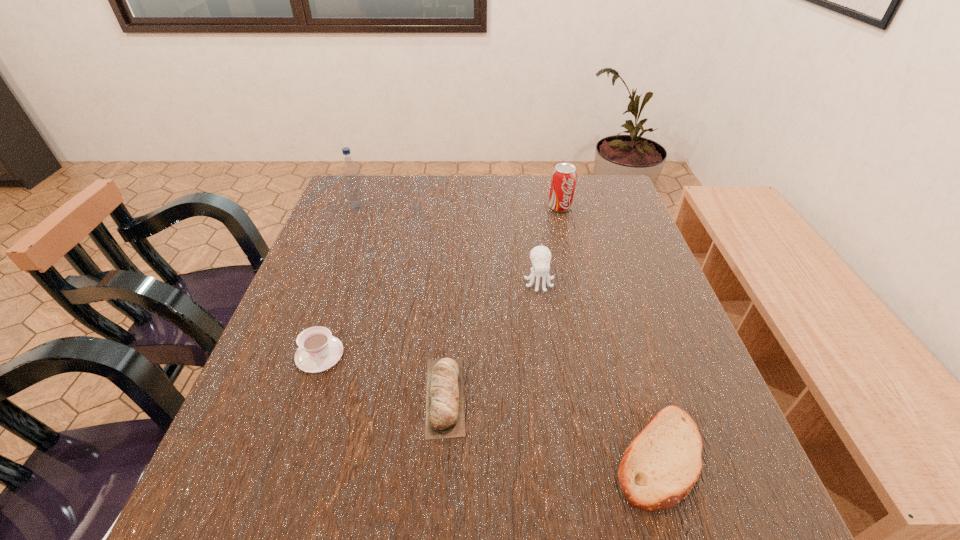
Identify which object is the fourth closest to the shortest object. Please provide its 2D coordinates. Your answer should be formatted as a tuple, i.e. [(x, y)], where the tuple contains the x and y coordinates of a point satisfying the conditions above.

[(564, 176)]

Image resolution: width=960 pixels, height=540 pixels. Identify the location of vacant point that satisfies the following two spatial constraints: 1. on the front side of the left pita bread; 2. on the left side of the water bottle. (288, 396).

Locate an element on the screen. The width and height of the screenshot is (960, 540). free spot that satisfies the following two spatial constraints: 1. on the back side of the second tallest object; 2. on the left side of the taller pita bread is located at coordinates (458, 207).